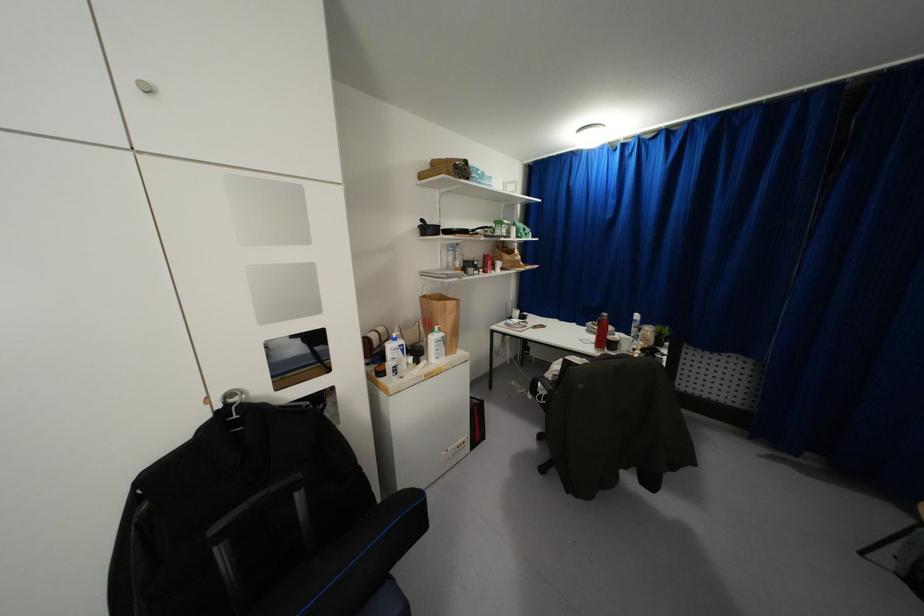
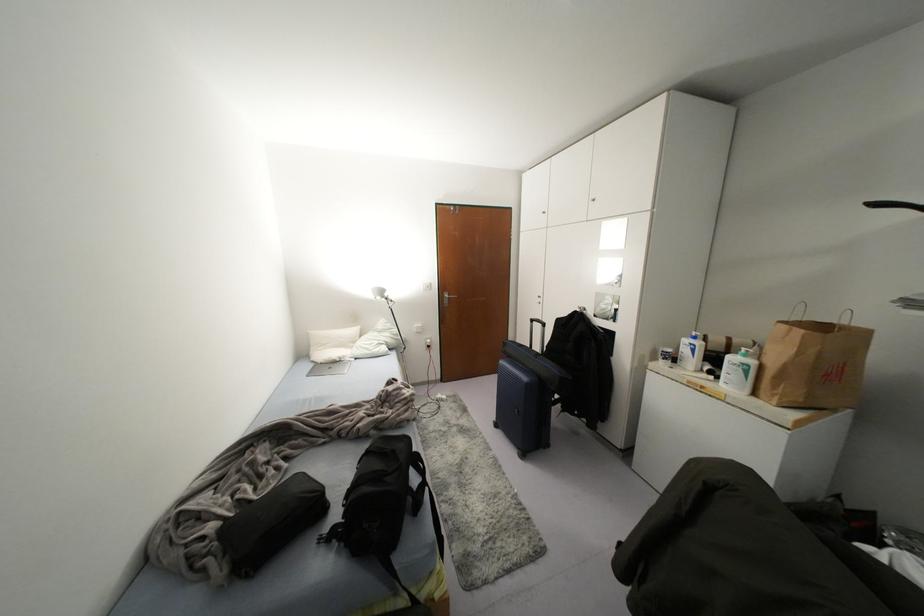
Locate, in the second image, the point that corresponds to point 402,350 in the first image.

(691, 350)